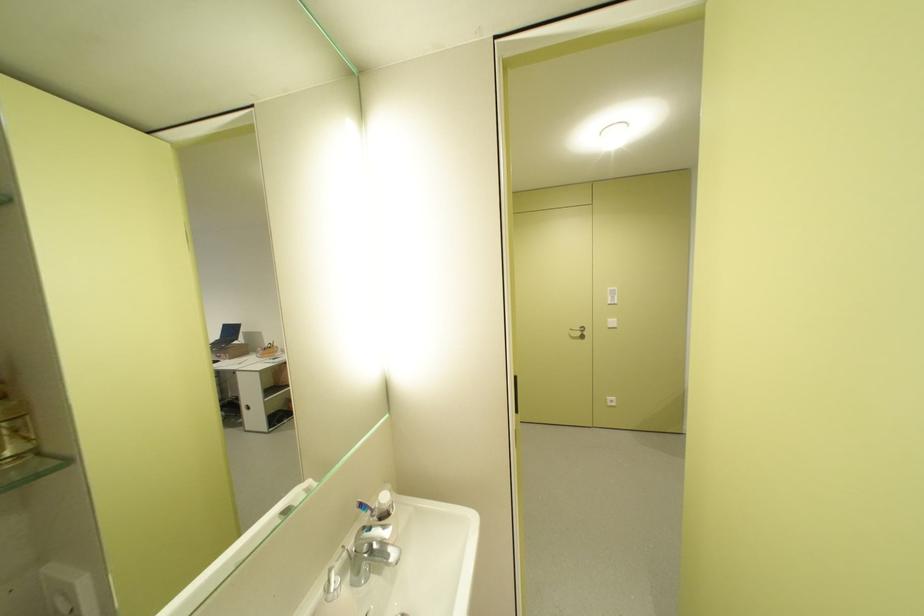
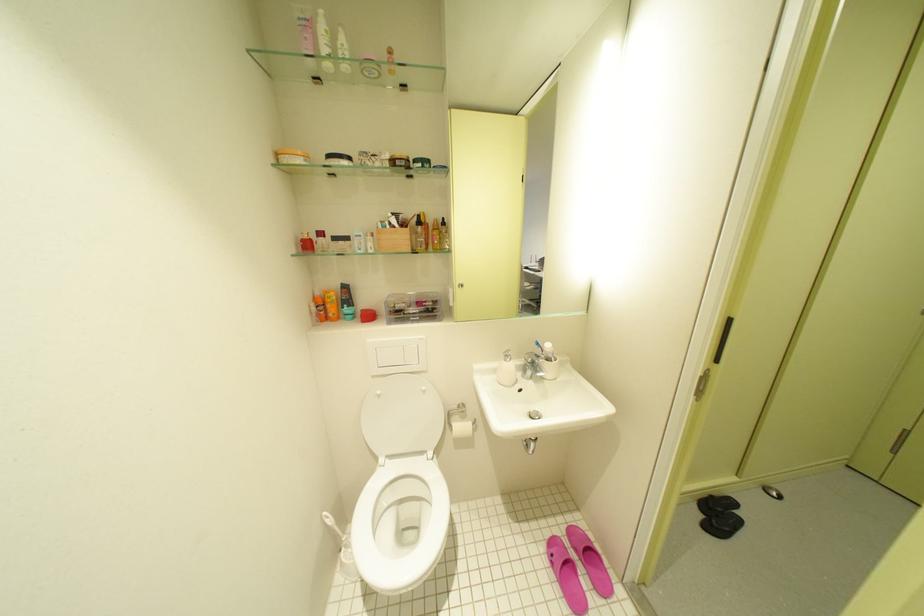
Where in the second image is the point corresponding to point (361, 586) from the first image?

(531, 378)